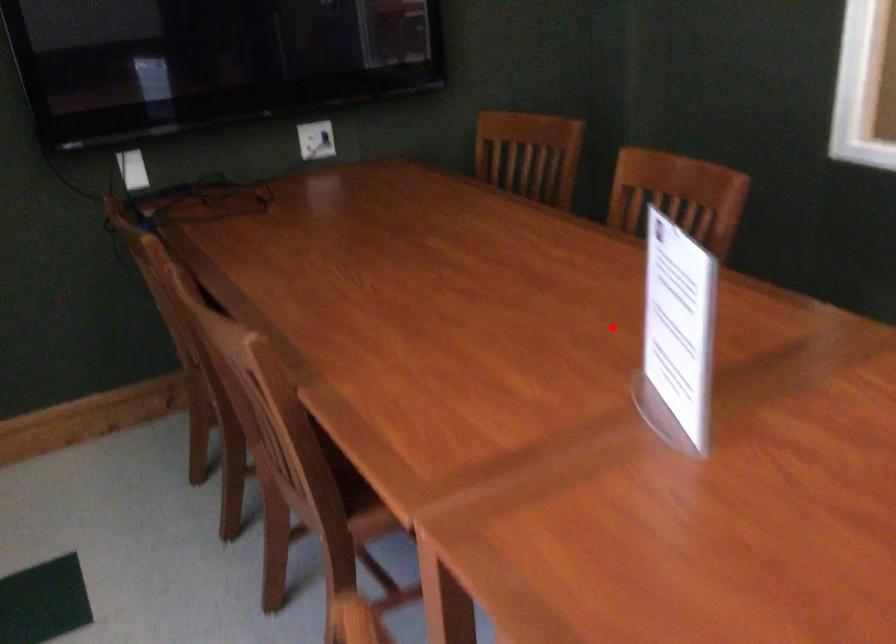
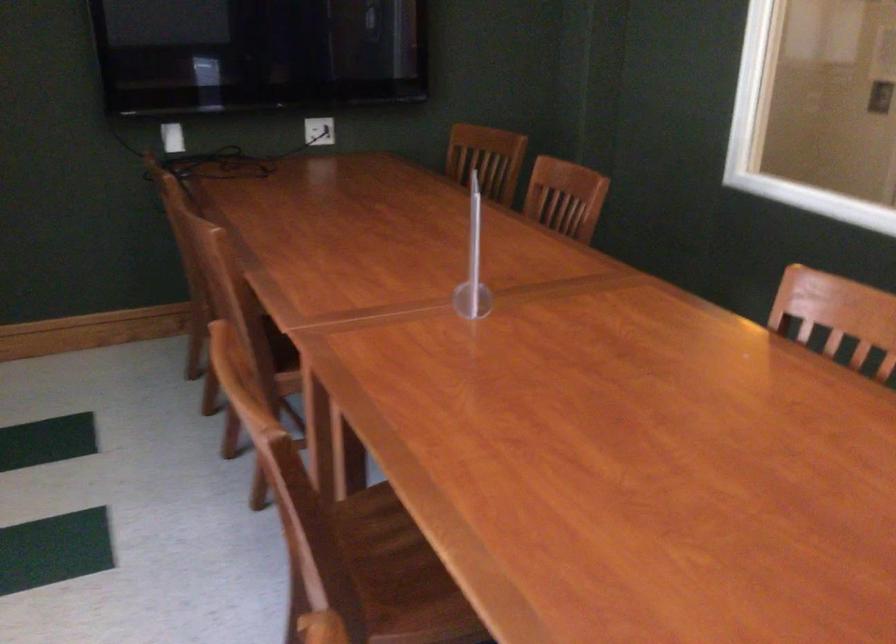
Where in the second image is the point corresponding to the highlighted location from the first image?

(472, 263)